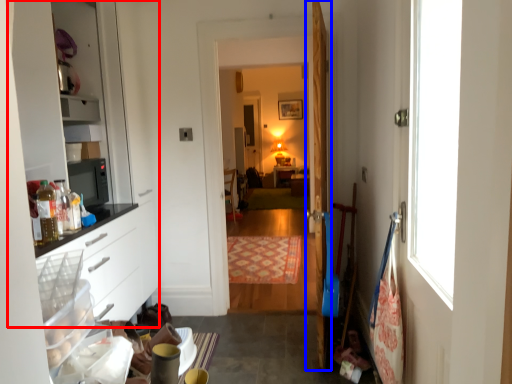
Question: Which object is further to the camera taking this photo, dresser (highlighted by a red box) or door (highlighted by a blue box)?

Choices:
 (A) dresser
 (B) door

Answer: (B)